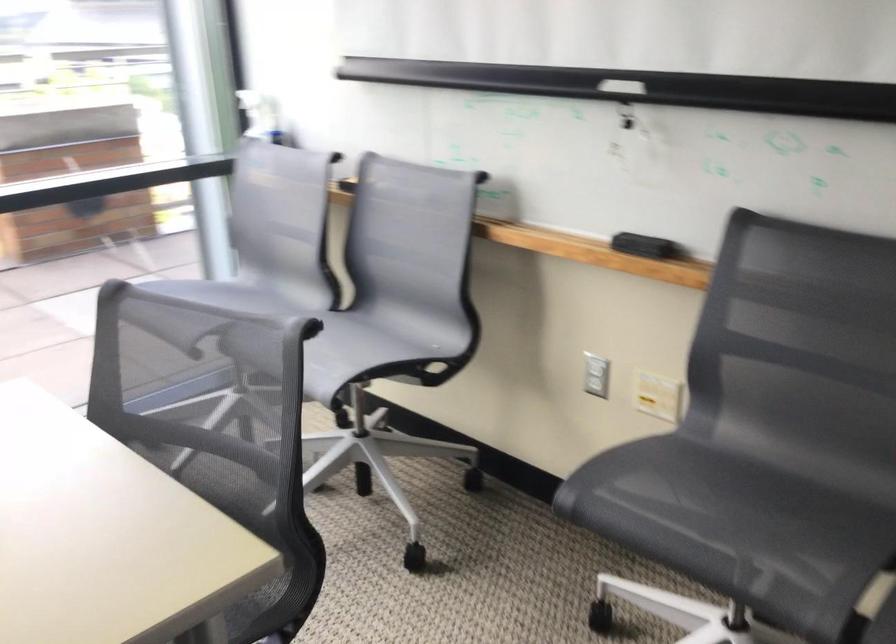
Where would you lift the chair handle cutout? Please return your answer as a coordinate pair (x, y).

(457, 182)